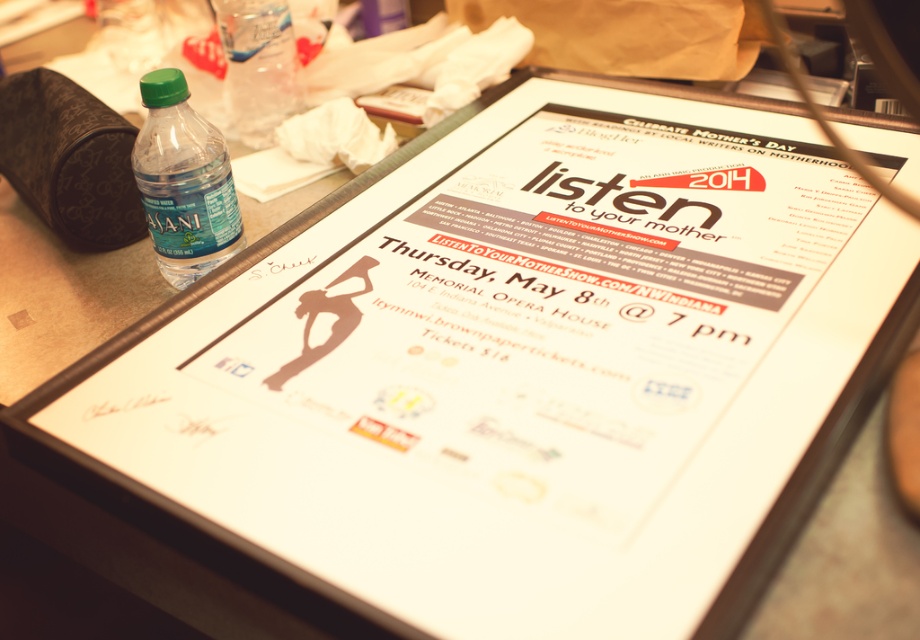
Question: Does green matte plastic bottle at left have a greater width compared to translucent plastic bottle at upper left?

Choices:
 (A) yes
 (B) no

Answer: (B)

Question: Does green matte plastic bottle at left appear under translucent plastic bottle at upper left?

Choices:
 (A) yes
 (B) no

Answer: (A)

Question: Does green matte plastic bottle at left appear on the left side of translucent plastic bottle at upper left?

Choices:
 (A) yes
 (B) no

Answer: (B)